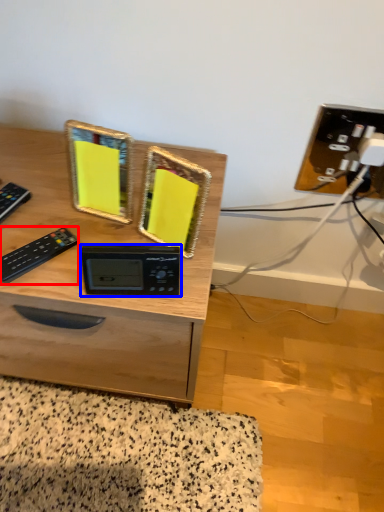
Question: Among these objects, which one is nearest to the camera, control (highlighted by a red box) or appliance (highlighted by a blue box)?

Choices:
 (A) control
 (B) appliance

Answer: (B)